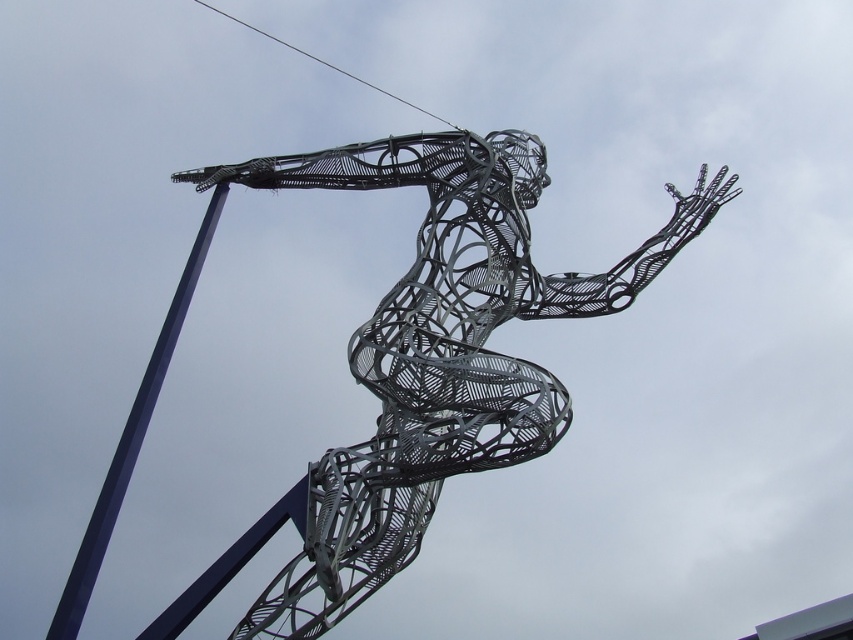
Locate an element on the screen. The height and width of the screenshot is (640, 853). metallic wire sculpture at center is located at coordinates (439, 352).

What do you see at coordinates (439, 352) in the screenshot?
I see `metallic wire sculpture at center` at bounding box center [439, 352].

Image resolution: width=853 pixels, height=640 pixels. What do you see at coordinates (439, 352) in the screenshot?
I see `metallic wire sculpture at center` at bounding box center [439, 352].

Where is `metallic wire sculpture at center`? metallic wire sculpture at center is located at coordinates (439, 352).

Which is more to the left, blue metallic pole at left or metallic wire at upper center?

blue metallic pole at left is more to the left.

Does blue metallic pole at left have a lesser height compared to metallic wire at upper center?

No.

Is point (122, 464) positioned before point (352, 76)?

Yes, point (122, 464) is closer to viewer.

Where is `blue metallic pole at left`? Image resolution: width=853 pixels, height=640 pixels. blue metallic pole at left is located at coordinates (131, 436).

Does point (310, 522) come farther from viewer compared to point (202, 243)?

No, it is in front of (202, 243).

Is metallic wire sculpture at center to the right of blue metallic pole at left from the viewer's perspective?

Indeed, metallic wire sculpture at center is positioned on the right side of blue metallic pole at left.

Who is more distant from viewer, [426,346] or [96,564]?

Positioned behind is point [96,564].

Find the location of a particular element. metallic wire sculpture at center is located at coordinates (439, 352).